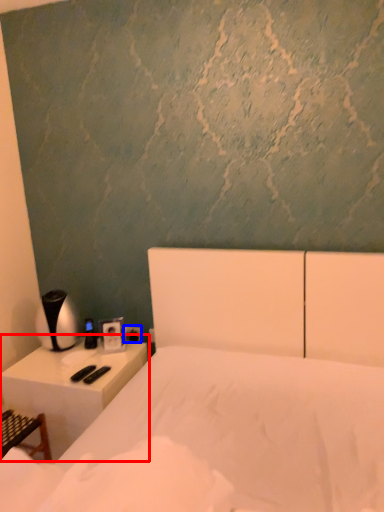
Question: Which of the following is the farthest to the observer, nightstand (highlighted by a red box) or electric outlet (highlighted by a blue box)?

Choices:
 (A) nightstand
 (B) electric outlet

Answer: (B)